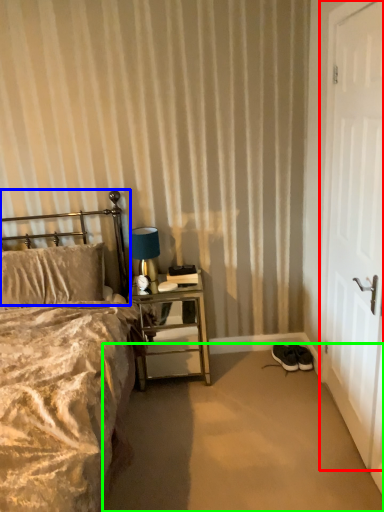
Question: Which is nearer to the door (highlighted by a red box)? headboard (highlighted by a blue box) or plain (highlighted by a green box).

Choices:
 (A) headboard
 (B) plain

Answer: (B)